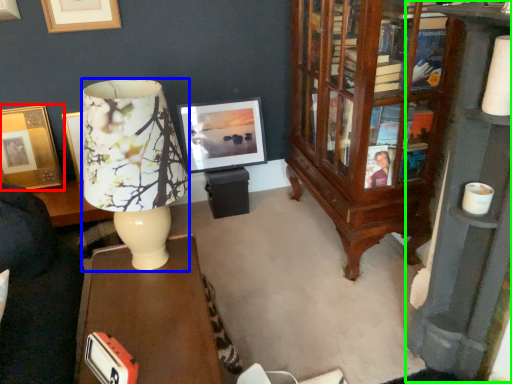
Question: Which object is positioned farthest from picture frame (highlighted by a red box)? Select from lamp (highlighted by a blue box) and bookcase (highlighted by a green box).

Choices:
 (A) lamp
 (B) bookcase

Answer: (B)